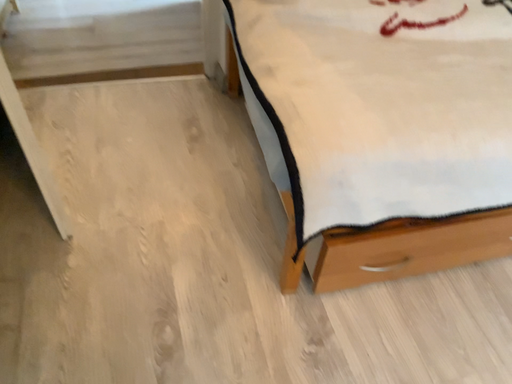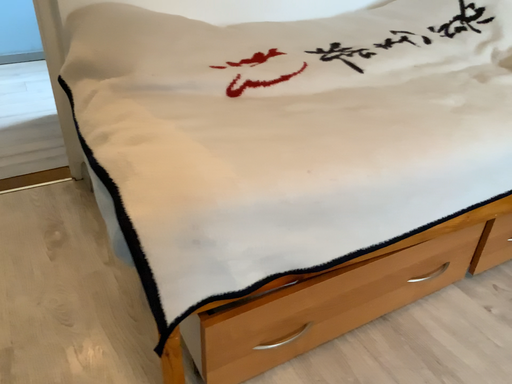
Question: How did the camera likely rotate when shooting the video?

Choices:
 (A) rotated downward
 (B) rotated upward

Answer: (B)